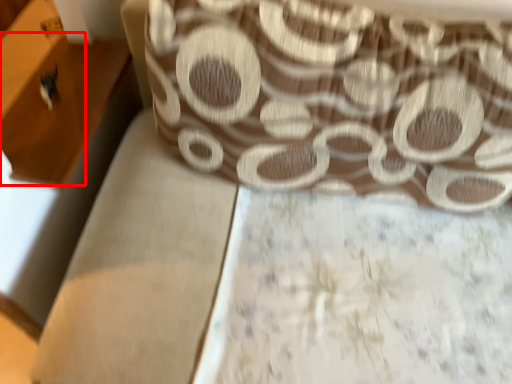
Question: From the image's perspective, where is drawer (annotated by the red box) located relative to curtain?

Choices:
 (A) below
 (B) above

Answer: (B)